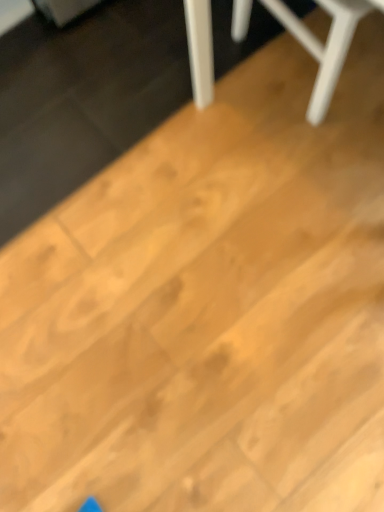
Where is `white matte chair at upper right`? white matte chair at upper right is located at coordinates (326, 44).

Describe the element at coordinates (326, 44) in the screenshot. I see `white matte chair at upper right` at that location.

In order to face white matte chair at upper right, should I rotate leftwards or rightwards?

To face it directly, rotate right by 17.470 degrees.

Where is `white matte chair at upper right`? The width and height of the screenshot is (384, 512). white matte chair at upper right is located at coordinates (326, 44).